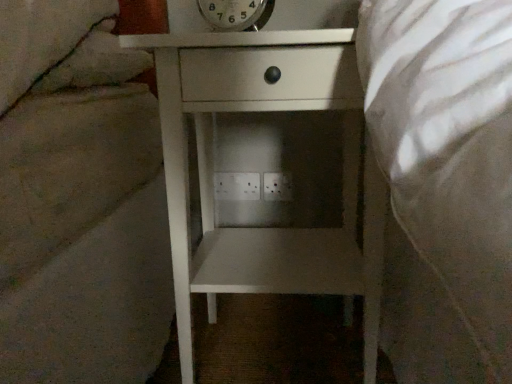
Question: In which direction should I rotate to look at white plastic electric outlet at center, arranged as the 2th electric outlet when viewed from the left?

Choices:
 (A) left
 (B) right

Answer: (B)

Question: Does white plastic electric outlet at center, which is the 1th electric outlet in left-to-right order, appear on the left side of white matte nightstand at center?

Choices:
 (A) yes
 (B) no

Answer: (A)

Question: Would you say white plastic electric outlet at center, which is the 1th electric outlet in left-to-right order, contains white matte nightstand at center?

Choices:
 (A) yes
 (B) no

Answer: (B)

Question: Considering the relative sizes of white plastic electric outlet at center, positioned as the second electric outlet in right-to-left order, and white matte nightstand at center in the image provided, is white plastic electric outlet at center, positioned as the second electric outlet in right-to-left order, wider than white matte nightstand at center?

Choices:
 (A) no
 (B) yes

Answer: (A)

Question: Is the position of white plastic electric outlet at center, positioned as the second electric outlet in right-to-left order, more distant than that of white matte nightstand at center?

Choices:
 (A) no
 (B) yes

Answer: (B)

Question: From the image's perspective, is white plastic electric outlet at center, which is the 1th electric outlet in left-to-right order, on top of white matte nightstand at center?

Choices:
 (A) no
 (B) yes

Answer: (B)

Question: Can you see white plastic electric outlet at center, positioned as the second electric outlet in right-to-left order, touching white matte nightstand at center?

Choices:
 (A) no
 (B) yes

Answer: (A)

Question: Does metallic silver clock at upper center appear on the right side of white plastic electric outlet at center, arranged as the 2th electric outlet when viewed from the left?

Choices:
 (A) no
 (B) yes

Answer: (A)

Question: Is metallic silver clock at upper center in contact with white plastic electric outlet at center, which appears as the 1th electric outlet when viewed from the right?

Choices:
 (A) yes
 (B) no

Answer: (B)

Question: Is metallic silver clock at upper center taller than white plastic electric outlet at center, which appears as the 1th electric outlet when viewed from the right?

Choices:
 (A) yes
 (B) no

Answer: (A)

Question: From the image's perspective, is metallic silver clock at upper center on top of white plastic electric outlet at center, which appears as the 1th electric outlet when viewed from the right?

Choices:
 (A) no
 (B) yes

Answer: (B)

Question: Can you confirm if metallic silver clock at upper center is shorter than white plastic electric outlet at center, which appears as the 1th electric outlet when viewed from the right?

Choices:
 (A) no
 (B) yes

Answer: (A)

Question: Could you tell me if metallic silver clock at upper center is facing white plastic electric outlet at center, which appears as the 1th electric outlet when viewed from the right?

Choices:
 (A) no
 (B) yes

Answer: (A)

Question: From the image's perspective, is metallic silver clock at upper center above white plastic electric outlet at center, positioned as the second electric outlet in right-to-left order?

Choices:
 (A) no
 (B) yes

Answer: (B)